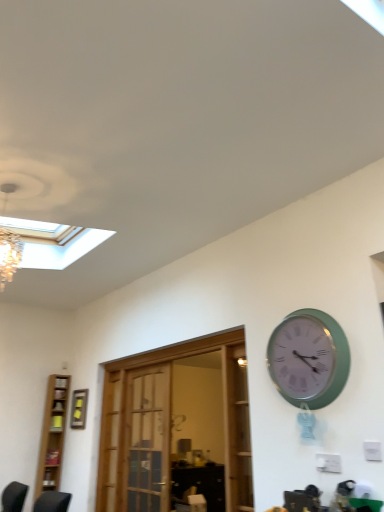
This screenshot has width=384, height=512. Describe the element at coordinates (52, 435) in the screenshot. I see `light brown wooden bookshelf at left` at that location.

What is the approximate width of green plastic wall clock at upper right?

It is 3.57 inches.

Image resolution: width=384 pixels, height=512 pixels. Identify the location of yellow matte picture frame at upper left. (79, 409).

Consider the image. Considering the sizes of objects green plastic wall clock at upper right and wooden door at center in the image provided, who is thinner, green plastic wall clock at upper right or wooden door at center?

green plastic wall clock at upper right.

From a real-world perspective, which is physically above, green plastic wall clock at upper right or wooden door at center?

green plastic wall clock at upper right, from a real-world perspective.

Which is behind, point (296, 347) or point (152, 387)?

The point (152, 387) is farther.

Considering the relative sizes of yellow matte picture frame at upper left and light brown wooden bookshelf at left in the image provided, is yellow matte picture frame at upper left taller than light brown wooden bookshelf at left?

In fact, yellow matte picture frame at upper left may be shorter than light brown wooden bookshelf at left.

Is point (81, 405) closer to camera compared to point (51, 452)?

Yes, point (81, 405) is closer to viewer.

From a real-world perspective, is yellow matte picture frame at upper left located beneath light brown wooden bookshelf at left?

No, from a real-world perspective, yellow matte picture frame at upper left is not below light brown wooden bookshelf at left.

Is light brown wooden bookshelf at left a part of yellow matte picture frame at upper left?

No, light brown wooden bookshelf at left is not inside yellow matte picture frame at upper left.

Identify the location of door located below the green plastic wall clock at upper right (from the image's perspective). (166, 426).

Considering the positions of objects wooden door at center and green plastic wall clock at upper right in the image provided, who is behind, wooden door at center or green plastic wall clock at upper right?

wooden door at center is further away from the camera.

From the image's perspective, is wooden door at center above or below green plastic wall clock at upper right?

Based on their image positions, wooden door at center is located beneath green plastic wall clock at upper right.

Which object is thinner, light brown wooden bookshelf at left or yellow matte picture frame at upper left?

yellow matte picture frame at upper left.

Is light brown wooden bookshelf at left positioned far away from yellow matte picture frame at upper left?

That's not correct — light brown wooden bookshelf at left is a little close to yellow matte picture frame at upper left.

From the image's perspective, which is below, light brown wooden bookshelf at left or yellow matte picture frame at upper left?

light brown wooden bookshelf at left.

Considering the relative positions of light brown wooden bookshelf at left and yellow matte picture frame at upper left in the image provided, is light brown wooden bookshelf at left to the left or to the right of yellow matte picture frame at upper left?

light brown wooden bookshelf at left is positioned on yellow matte picture frame at upper left's left side.

From a real-world perspective, is green plastic wall clock at upper right physically located above or below yellow matte picture frame at upper left?

From a real-world perspective, green plastic wall clock at upper right is physically above yellow matte picture frame at upper left.

Is green plastic wall clock at upper right oriented away from yellow matte picture frame at upper left?

No.

Could yellow matte picture frame at upper left be considered to be inside green plastic wall clock at upper right?

No.

Does green plastic wall clock at upper right have a larger size compared to yellow matte picture frame at upper left?

Yes, green plastic wall clock at upper right is bigger than yellow matte picture frame at upper left.

Is wooden door at center bigger than yellow matte picture frame at upper left?

Yes, wooden door at center is bigger than yellow matte picture frame at upper left.

Find the location of a particular element. This screenshot has height=512, width=384. door above the yellow matte picture frame at upper left (from the image's perspective) is located at coordinates (166, 426).

Is wooden door at center far from yellow matte picture frame at upper left?

Yes, wooden door at center and yellow matte picture frame at upper left are quite far apart.

Is yellow matte picture frame at upper left facing towards wooden door at center?

No, yellow matte picture frame at upper left is not facing towards wooden door at center.

Based on their positions, is yellow matte picture frame at upper left located to the left or right of wooden door at center?

From the image, it's evident that yellow matte picture frame at upper left is to the left of wooden door at center.

How much distance is there between yellow matte picture frame at upper left and wooden door at center?

A distance of 1.00 meters exists between yellow matte picture frame at upper left and wooden door at center.

Is yellow matte picture frame at upper left positioned far away from wooden door at center?

Absolutely, yellow matte picture frame at upper left is distant from wooden door at center.

This screenshot has width=384, height=512. Find the location of `door on the left of green plastic wall clock at upper right`. door on the left of green plastic wall clock at upper right is located at coordinates (166, 426).

Identify the location of bookshelf below the yellow matte picture frame at upper left (from a real-world perspective). (52, 435).

Which object lies further to the anchor point wooden door at center, yellow matte picture frame at upper left or light brown wooden bookshelf at left?

The object further to wooden door at center is light brown wooden bookshelf at left.

From the picture: When comparing their distances from wooden door at center, does light brown wooden bookshelf at left or yellow matte picture frame at upper left seem closer?

yellow matte picture frame at upper left lies closer to wooden door at center than the other object.

Estimate the real-world distances between objects in this image. Which object is closer to green plastic wall clock at upper right, yellow matte picture frame at upper left or wooden door at center?

The object closer to green plastic wall clock at upper right is wooden door at center.

Which object lies further to the anchor point light brown wooden bookshelf at left, green plastic wall clock at upper right or wooden door at center?

green plastic wall clock at upper right.

Based on their spatial positions, is wooden door at center or light brown wooden bookshelf at left further from green plastic wall clock at upper right?

light brown wooden bookshelf at left lies further to green plastic wall clock at upper right than the other object.

Based on their spatial positions, is green plastic wall clock at upper right or yellow matte picture frame at upper left further from light brown wooden bookshelf at left?

Based on the image, green plastic wall clock at upper right appears to be further to light brown wooden bookshelf at left.

Estimate the real-world distances between objects in this image. Which object is further from green plastic wall clock at upper right, light brown wooden bookshelf at left or wooden door at center?

light brown wooden bookshelf at left is further to green plastic wall clock at upper right.

Based on their spatial positions, is yellow matte picture frame at upper left or green plastic wall clock at upper right further from wooden door at center?

Based on the image, green plastic wall clock at upper right appears to be further to wooden door at center.

Identify the location of bookshelf between wooden door at center and yellow matte picture frame at upper left along the z-axis. (52, 435).

The width and height of the screenshot is (384, 512). In order to click on bookshelf between green plastic wall clock at upper right and yellow matte picture frame at upper left along the z-axis in this screenshot , I will do `click(52, 435)`.

The width and height of the screenshot is (384, 512). Identify the location of door positioned between green plastic wall clock at upper right and yellow matte picture frame at upper left from near to far. (166, 426).

Image resolution: width=384 pixels, height=512 pixels. Identify the location of door between green plastic wall clock at upper right and light brown wooden bookshelf at left along the z-axis. (166, 426).